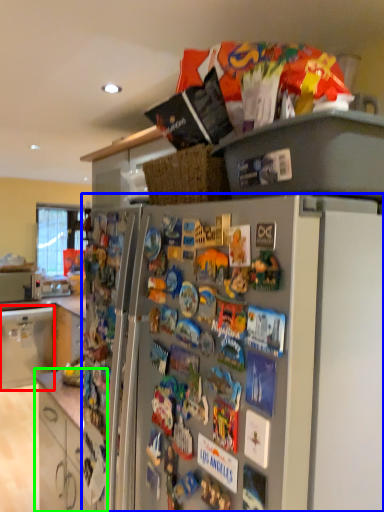
Question: Which is farther away from cabinetry (highlighted by a red box)? refrigerator (highlighted by a blue box) or cabinetry (highlighted by a green box)?

Choices:
 (A) refrigerator
 (B) cabinetry

Answer: (A)